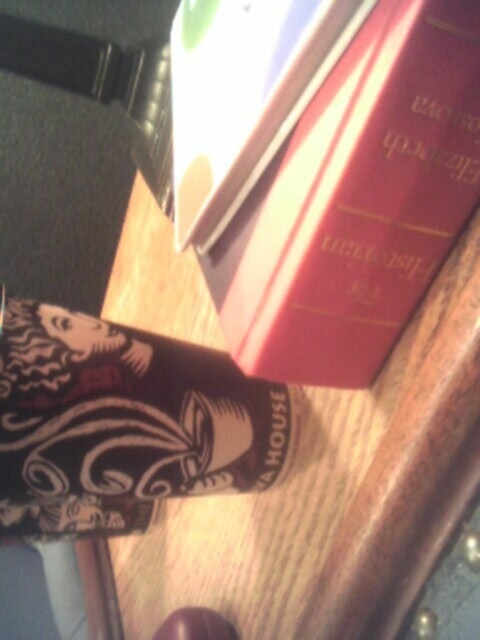
Who is lower down, matte red book at center or matte black book at center?

matte black book at center

Consider the image. Who is more forward, (268, 204) or (35, 518)?

Positioned in front is point (268, 204).

Does point (286, 4) come farther from viewer compared to point (276, 424)?

No, (286, 4) is in front of (276, 424).

At what (x,y) coordinates should I click in order to perform the action: click on matte red book at center. Please return your answer as a coordinate pair (x, y). Looking at the image, I should click on (323, 170).